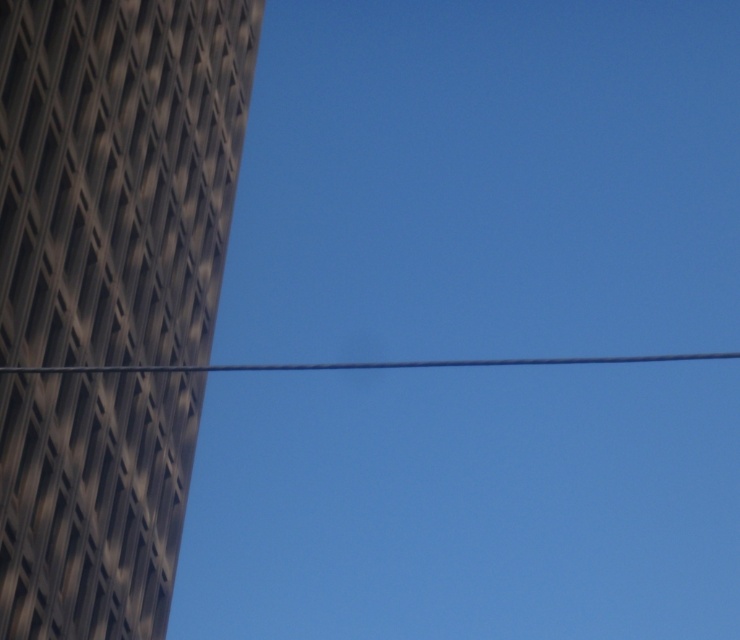
Who is lower down, dark brown textured tower at left or metallic wire at center?

metallic wire at center

Identify the location of dark brown textured tower at left. (118, 173).